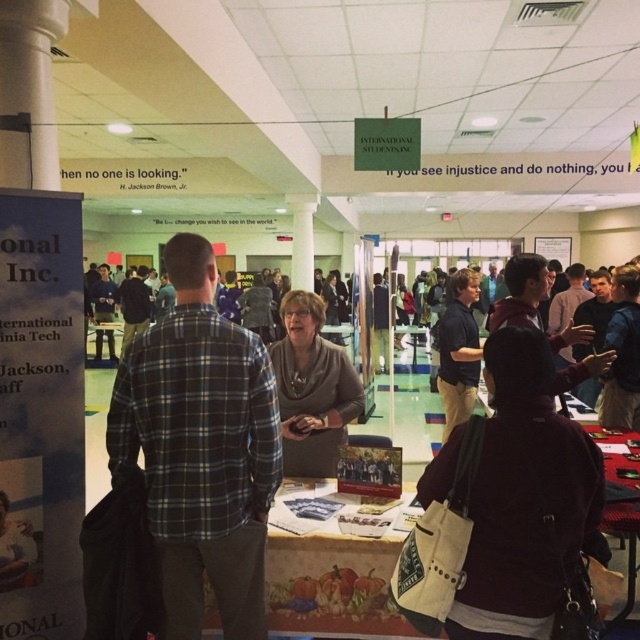
Question: Is plaid flannel shirt at center smaller than maroon fabric jacket at center?

Choices:
 (A) yes
 (B) no

Answer: (B)

Question: Observing the image, what is the correct spatial positioning of plaid flannel shirt at center in reference to maroon fabric jacket at center?

Choices:
 (A) right
 (B) left

Answer: (B)

Question: Is plaid flannel shirt at center smaller than maroon fabric jacket at center?

Choices:
 (A) yes
 (B) no

Answer: (B)

Question: Which of the following is the closest to the observer?

Choices:
 (A) (580, 548)
 (B) (224, 442)

Answer: (A)

Question: Among these objects, which one is nearest to the camera?

Choices:
 (A) plaid flannel shirt at center
 (B) maroon fabric jacket at center

Answer: (B)